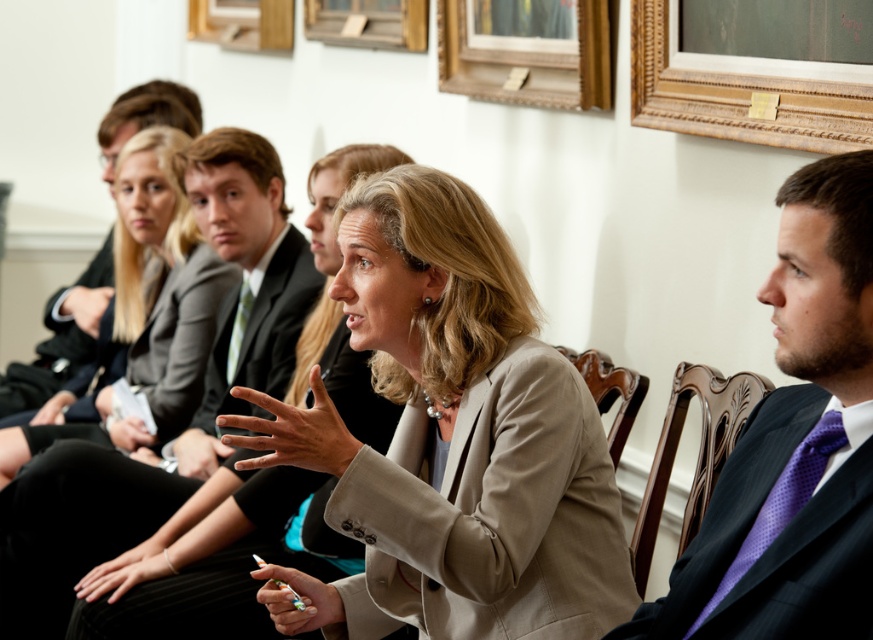
Question: Which object is the farthest from the mahogany wood chair at right?

Choices:
 (A) black fabric business suit at center
 (B) matte black suit at center
 (C) purple pinstripe tie at right
 (D) beige fabric jacket at center

Answer: (A)

Question: Is beige fabric jacket at center smaller than wooden frame at upper center?

Choices:
 (A) no
 (B) yes

Answer: (A)

Question: Among these points, which one is nearest to the camera?

Choices:
 (A) (246, 323)
 (B) (705, 76)

Answer: (B)

Question: Estimate the real-world distances between objects in this image. Which object is farther from the black fabric business suit at center?

Choices:
 (A) wooden frame at upper center
 (B) dark blue suit at center

Answer: (B)

Question: Is black fabric business suit at center to the left of mahogany wood chair at center from the viewer's perspective?

Choices:
 (A) yes
 (B) no

Answer: (A)

Question: Does beige fabric jacket at center have a larger size compared to wooden frame at upper center?

Choices:
 (A) yes
 (B) no

Answer: (A)